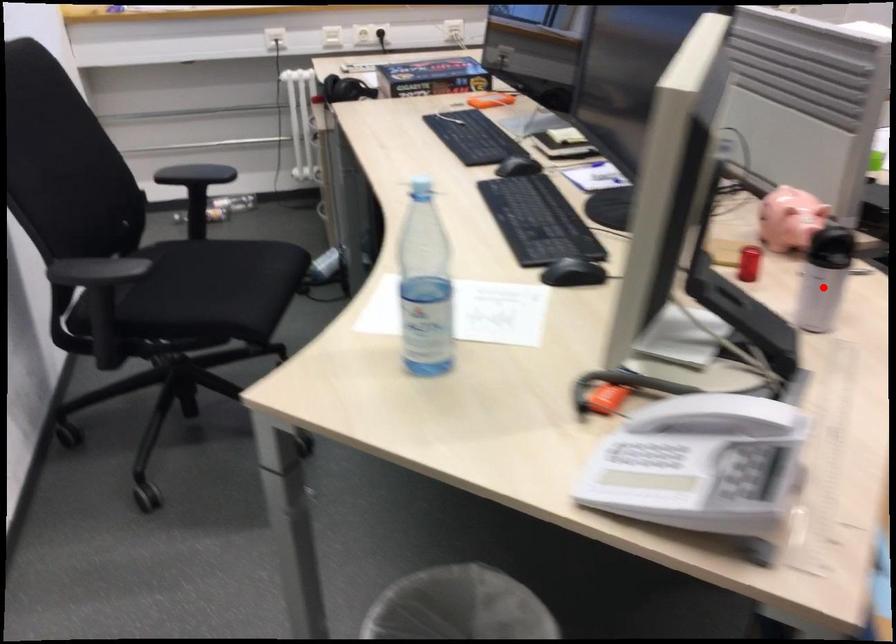
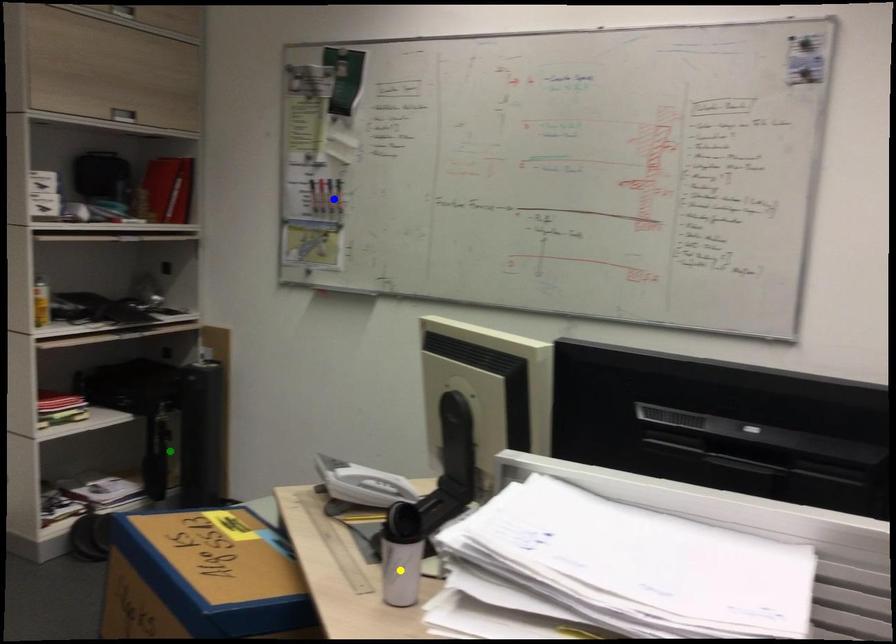
Question: I am providing you with two images of the same scene from different viewpoints. A red point is marked on the first image. You are given multiple points on the second image. Which mark in image 2 goes with the point in image 1?

Choices:
 (A) yellow point
 (B) blue point
 (C) green point

Answer: (A)